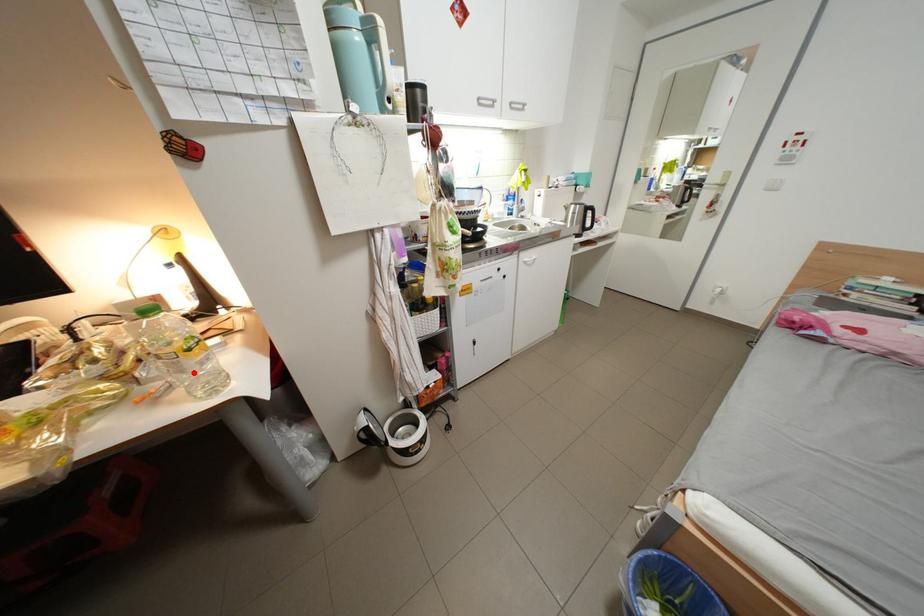
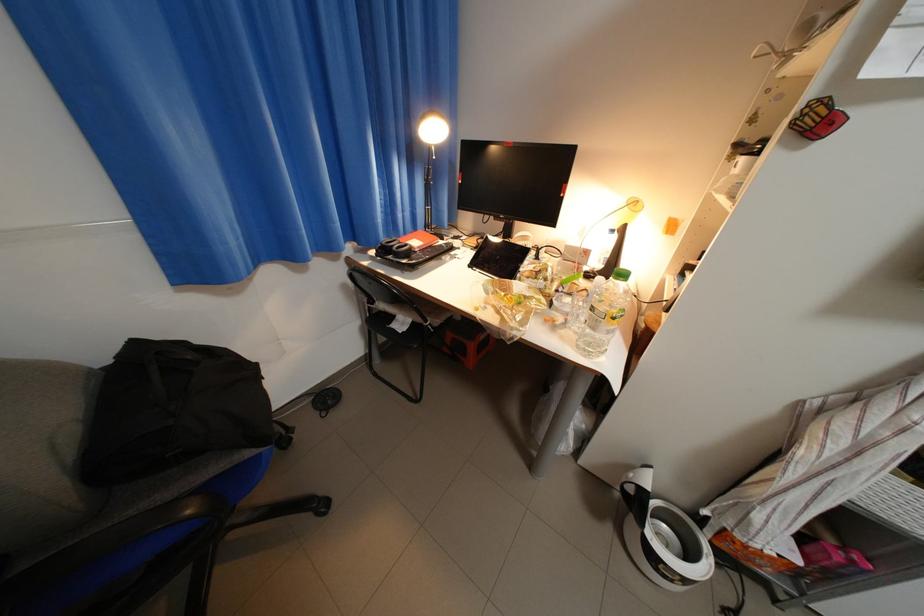
In the second image, find the point that corresponds to the highlighted location in the first image.

(605, 330)